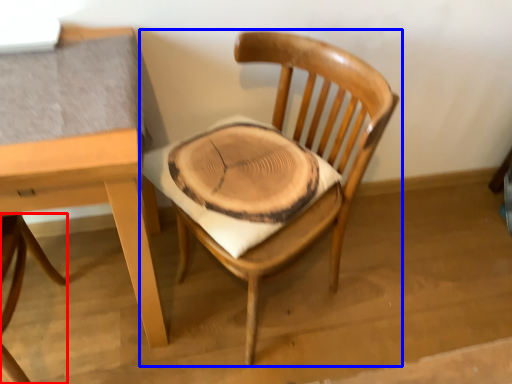
Question: Which point is closer to the camera, chair (highlighted by a red box) or chair (highlighted by a blue box)?

Choices:
 (A) chair
 (B) chair

Answer: (A)